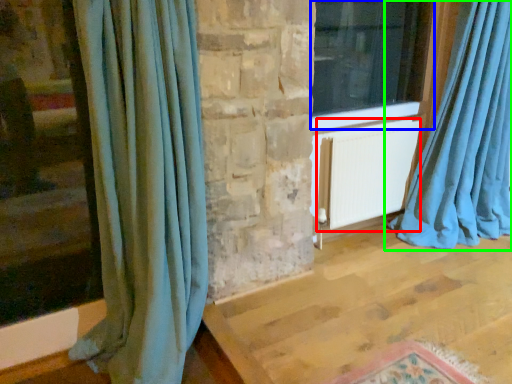
Question: Based on their relative distances, which object is farther from radiator (highlighted by a red box)? Choose from window (highlighted by a blue box) and curtain (highlighted by a green box).

Choices:
 (A) window
 (B) curtain

Answer: (A)